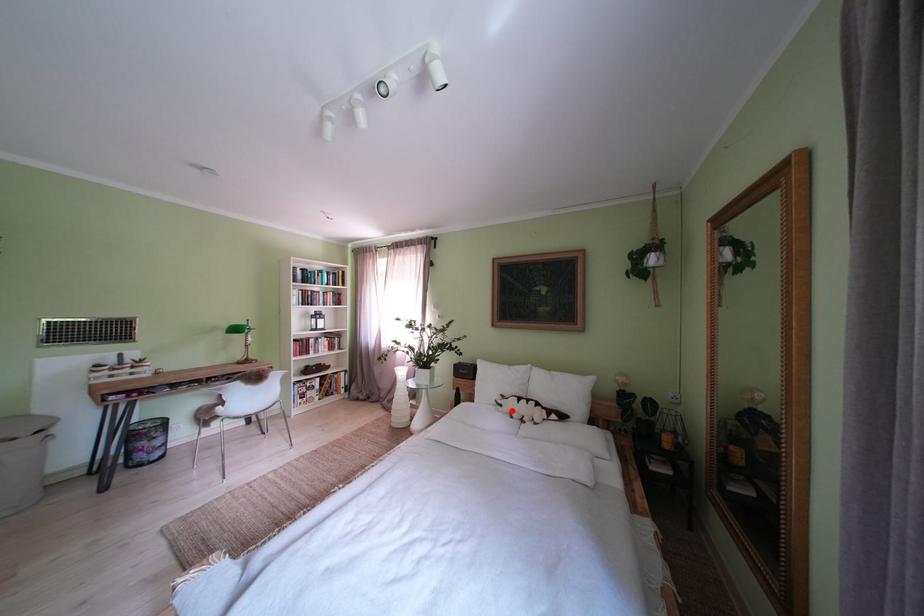
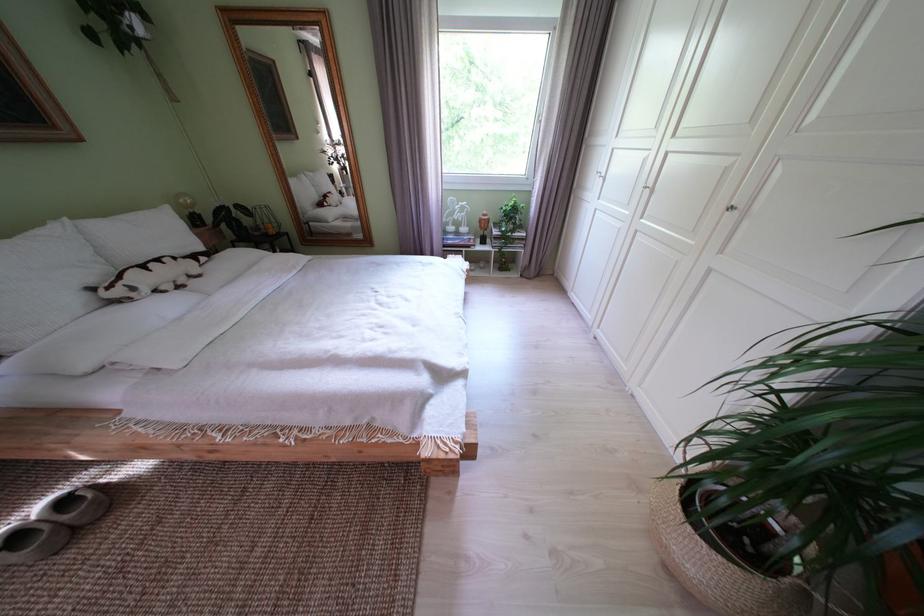
The point at the highlighted location is marked in the first image. Where is the corresponding point in the second image?

(146, 294)